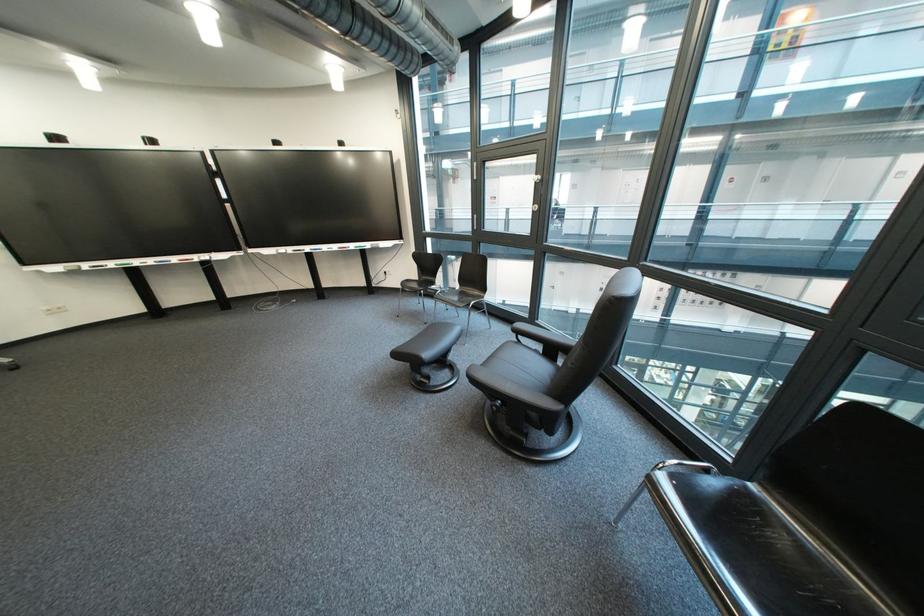
Find where to lift the green whiteboard marker. Please return your answer as a coordinate pair (x, y).

(126, 262)